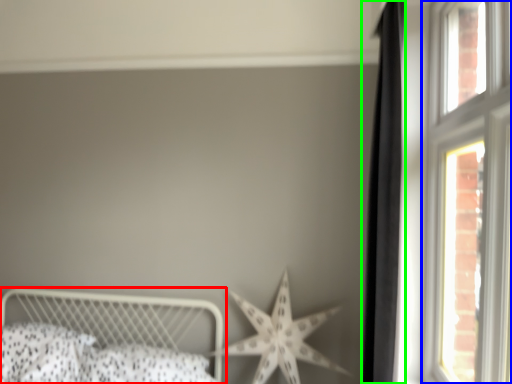
Question: Based on their relative distances, which object is nearer to bed (highlighted by a red box)? Choose from window (highlighted by a blue box) and curtain (highlighted by a green box).

Choices:
 (A) window
 (B) curtain

Answer: (B)